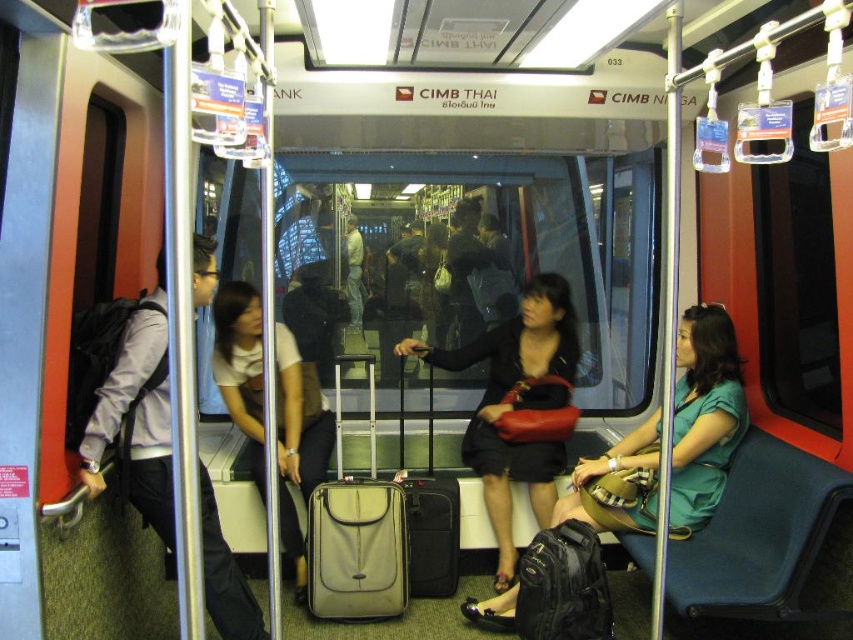
Question: Is the position of matte black handbag at center more distant than that of matte black backpack at left?

Choices:
 (A) yes
 (B) no

Answer: (A)

Question: Which of these objects is positioned farthest from the beige fabric suitcase at center?

Choices:
 (A) matte black backpack at left
 (B) matte gray suitcase at center
 (C) matte black jacket at center

Answer: (A)

Question: From the image, what is the correct spatial relationship of matte black handbag at center in relation to white matte suitcase at center?

Choices:
 (A) below
 (B) above

Answer: (B)

Question: Which point appears closest to the camera in this image?

Choices:
 (A) (434, 595)
 (B) (173, 525)
 (C) (463, 604)
 (D) (335, 412)

Answer: (B)

Question: Which object is the closest to the matte black backpack at left?

Choices:
 (A) matte gray suitcase at center
 (B) white matte suitcase at center
 (C) matte black jacket at center
 (D) matte black handbag at center

Answer: (B)

Question: Does matte black backpack at left have a smaller size compared to white matte suitcase at center?

Choices:
 (A) yes
 (B) no

Answer: (B)